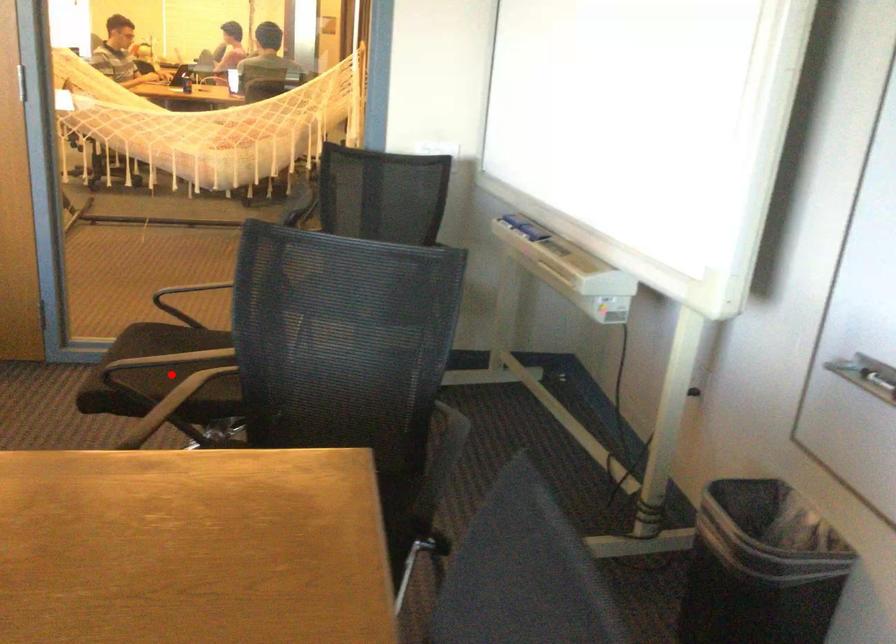
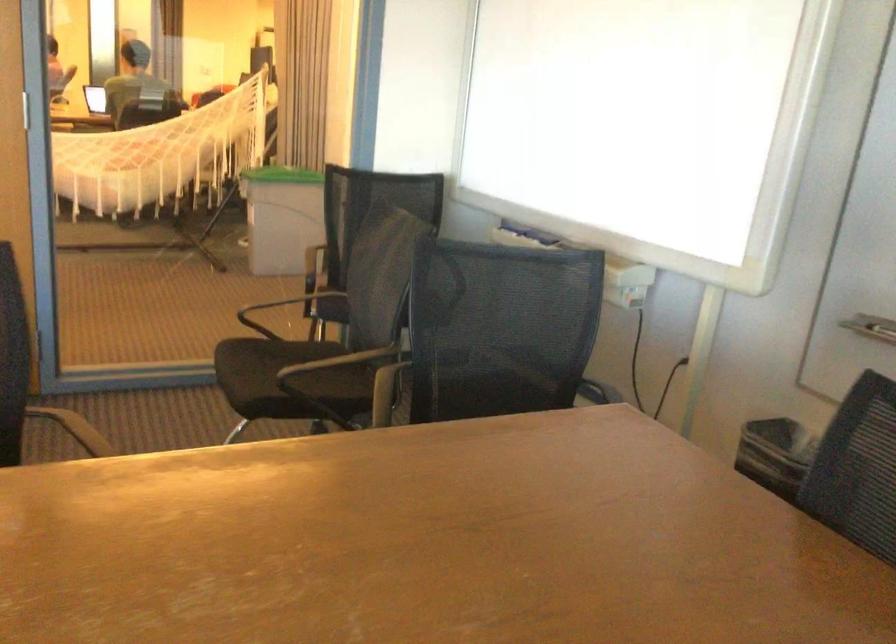
Question: A red point is marked in image1. In image2, is the corresponding 3D point closer to the camera or farther? Reply with the corresponding letter.

Choices:
 (A) The corresponding 3D point is closer.
 (B) The corresponding 3D point is farther.

Answer: (B)